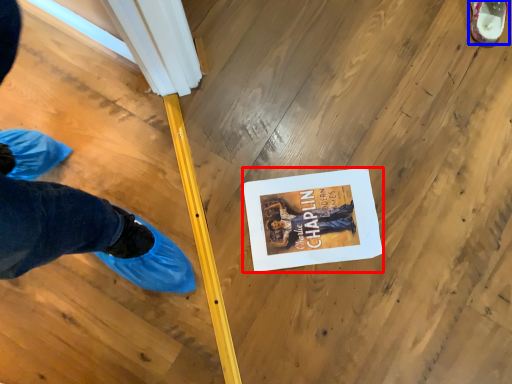
Question: Which of the following is the closest to the observer, magazine (highlighted by a red box) or footwear (highlighted by a blue box)?

Choices:
 (A) magazine
 (B) footwear

Answer: (A)